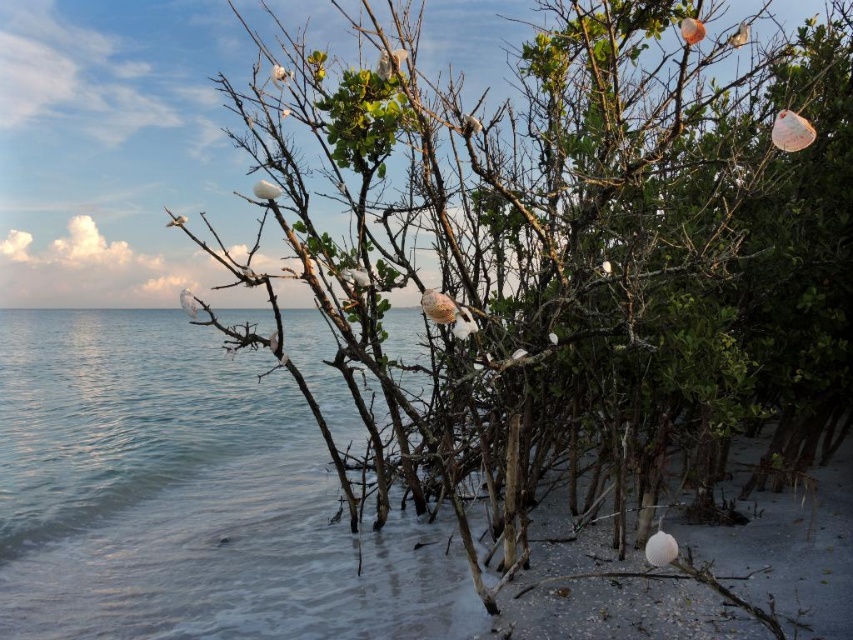
Question: Does clear water at lower left have a larger size compared to white fluffy bird at center?

Choices:
 (A) no
 (B) yes

Answer: (B)

Question: Which of the following is the farthest from the observer?

Choices:
 (A) (363, 282)
 (B) (436, 323)
 (C) (334, 499)
 (D) (181, 291)

Answer: (C)

Question: Considering the real-world distances, which object is closest to the white fluffy bird at upper center?

Choices:
 (A) clear water at lower left
 (B) white fluffy bird at center
 (C) white matte seashell at center

Answer: (B)

Question: Is white matte shell at upper center below white feathered bird at upper left?

Choices:
 (A) no
 (B) yes

Answer: (A)

Question: Does white matte seashell at center have a larger size compared to white feathered bird at upper left?

Choices:
 (A) no
 (B) yes

Answer: (B)

Question: Among these objects, which one is farthest from the camera?

Choices:
 (A) clear water at lower left
 (B) white feathered bird at upper left
 (C) white fluffy bird at center
 (D) white matte seashell at center

Answer: (B)